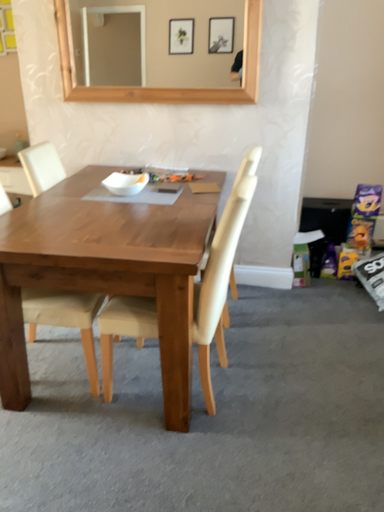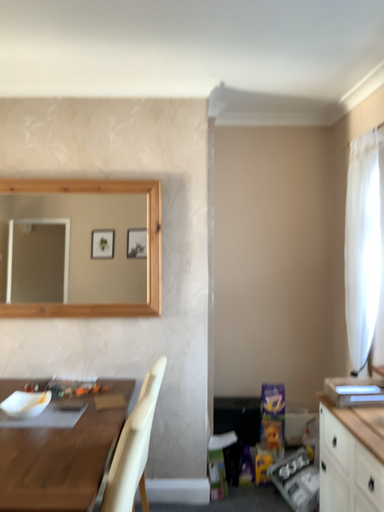
Question: How did the camera likely rotate when shooting the video?

Choices:
 (A) rotated left
 (B) rotated right

Answer: (B)